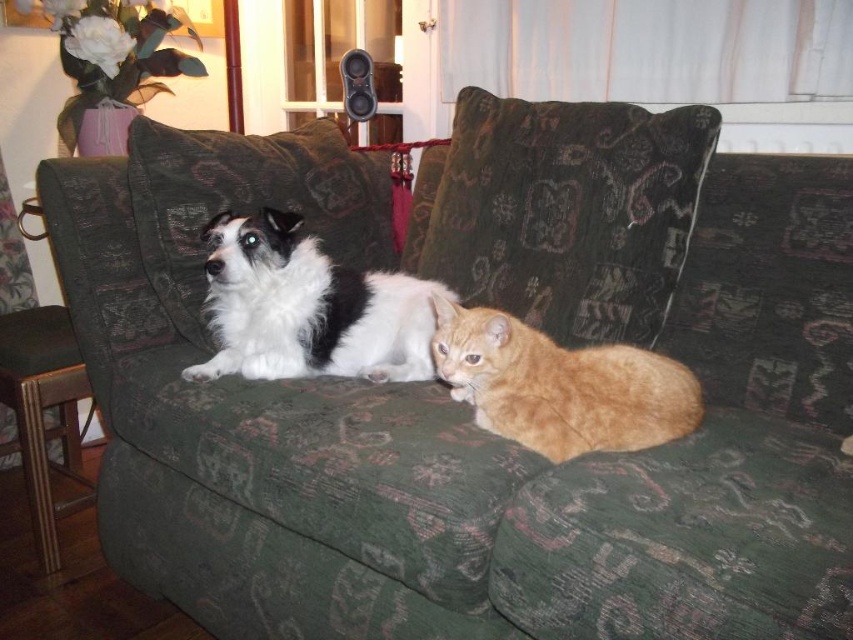
Who is higher up, white fluffy dog at center or orange fur cat at center?

white fluffy dog at center

Can you confirm if white fluffy dog at center is positioned below orange fur cat at center?

No.

Between point (289, 336) and point (497, 396), which one is positioned behind?

The point (289, 336) is more distant.

At what (x,y) coordinates should I click in order to perform the action: click on white fluffy dog at center. Please return your answer as a coordinate pair (x, y). Looking at the image, I should click on (306, 307).

Which is behind, point (622, 378) or point (360, 77)?

Positioned behind is point (360, 77).

Is orange fur cat at center thinner than black plastic speaker at upper center?

No, orange fur cat at center is not thinner than black plastic speaker at upper center.

In the scene shown: Measure the distance between point (596, 408) and camera.

The distance of point (596, 408) from camera is 1.12 meters.

You are a GUI agent. You are given a task and a screenshot of the screen. Output one action in this format:
    pyautogui.click(x=<x>, y=<y>)
    Task: Click on the orange fur cat at center
    
    Given the screenshot: What is the action you would take?
    coord(560,385)

Can you confirm if white fluffy dog at center is smaller than black plastic speaker at upper center?

Actually, white fluffy dog at center might be larger than black plastic speaker at upper center.

Can you confirm if white fluffy dog at center is bigger than black plastic speaker at upper center?

Yes, white fluffy dog at center is bigger than black plastic speaker at upper center.

Is point (274, 300) behind point (370, 65)?

No.

Identify the location of white fluffy dog at center. (306, 307).